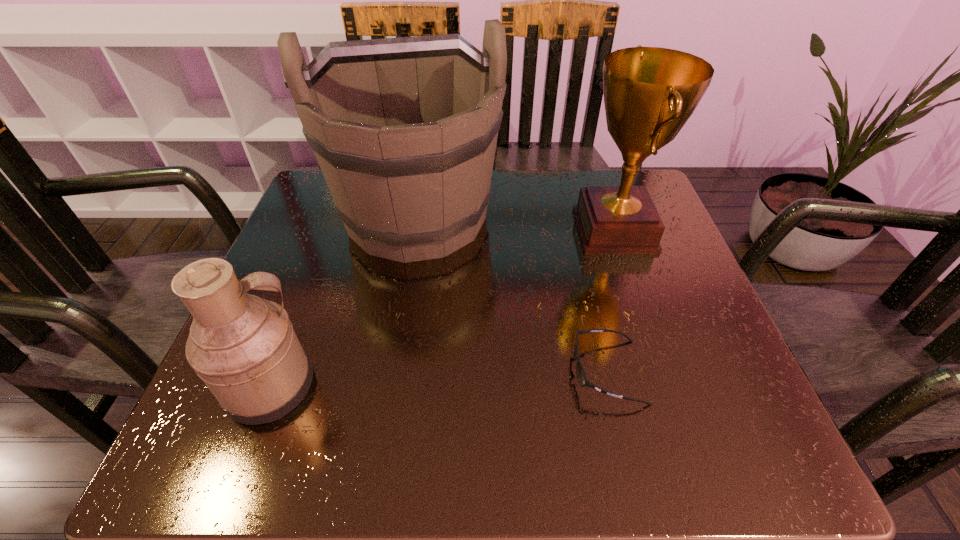
Where is `bucket`? bucket is located at coordinates (405, 129).

Where is `award`? award is located at coordinates (649, 93).

Find the location of a particular element. pitcher is located at coordinates (244, 348).

Locate an element on the screen. the shortest object is located at coordinates (581, 376).

Locate an element on the screen. free space located 0.130m on the right of the bucket is located at coordinates (557, 216).

This screenshot has width=960, height=540. In order to click on vacant region located on the plaque of the award in this screenshot , I will do [447, 230].

Identify the location of blank space located on the plaque of the award. This screenshot has height=540, width=960. (535, 230).

Find the location of `free spot located 0.160m on the plaque of the award`. free spot located 0.160m on the plaque of the award is located at coordinates (504, 230).

Image resolution: width=960 pixels, height=540 pixels. I want to click on vacant area situated on the back of the pitcher, so click(x=296, y=320).

The height and width of the screenshot is (540, 960). I want to click on vacant space situated on the front-facing side of the shortest object, so click(x=460, y=372).